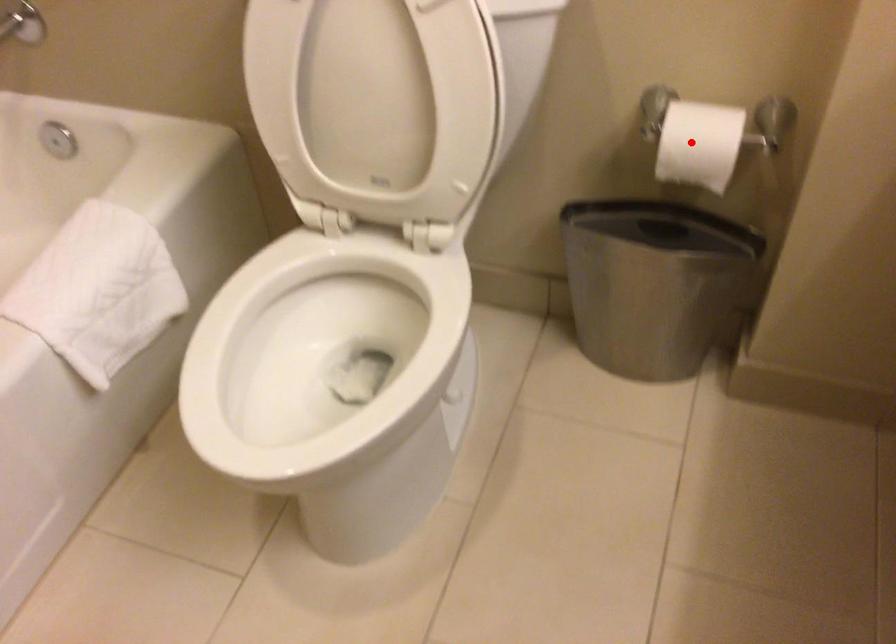
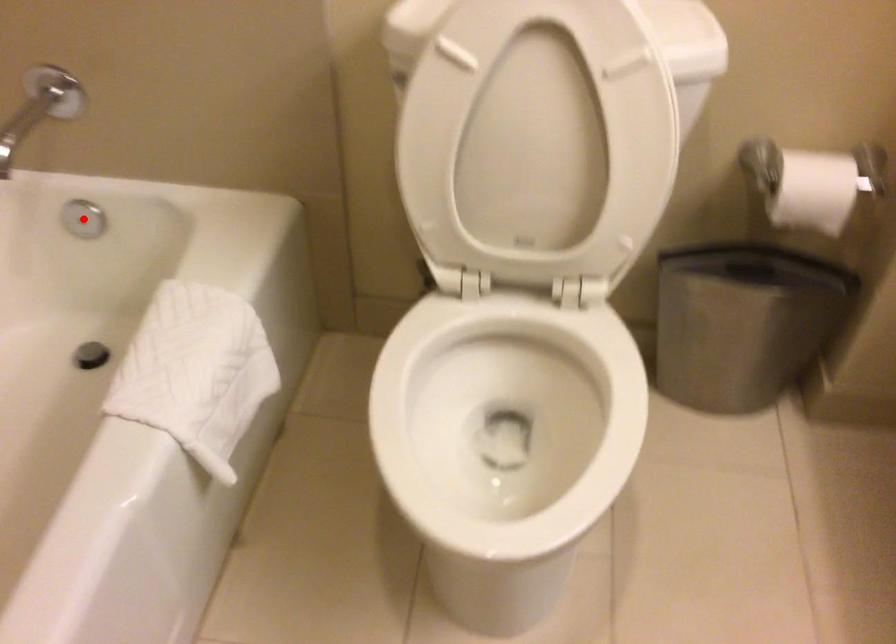
I am providing you with two images of the same scene from different viewpoints. A red point is marked on the first image and another point is marked on the second image. Are the points marked in image1 and image2 representing the same 3D position?

No